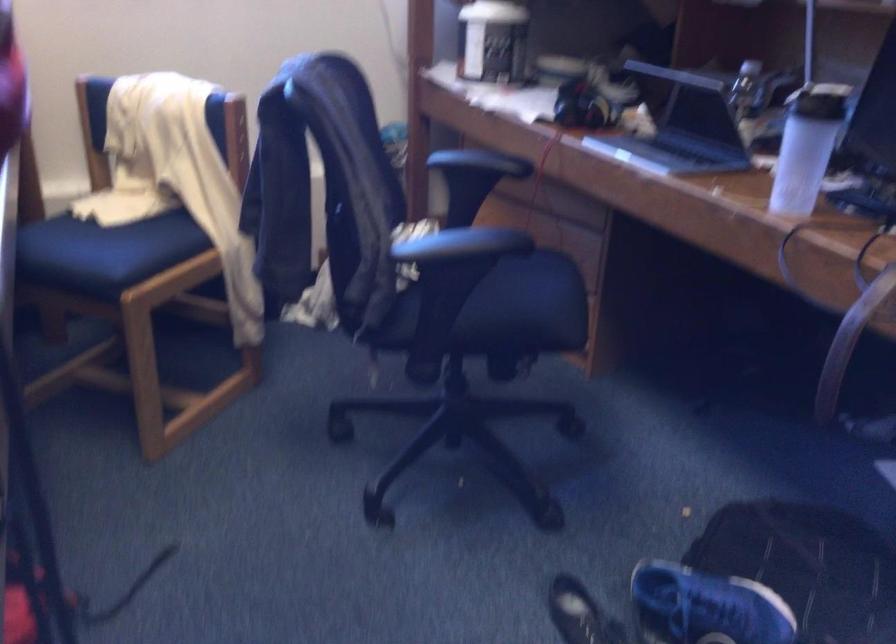
Which object does [806,147] point to?

This point indicates the white tumbler.